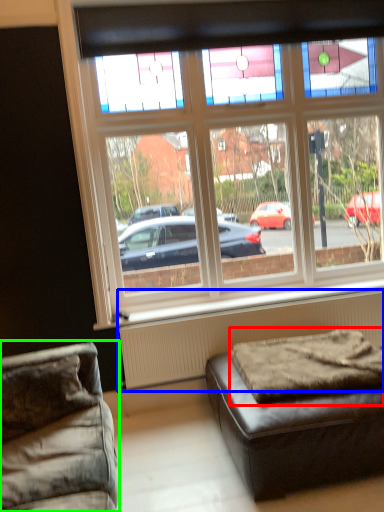
Question: Considering the real-world distances, which object is farthest from mattress (highlighted by a red box)? radiator (highlighted by a blue box) or studio couch (highlighted by a green box)?

Choices:
 (A) radiator
 (B) studio couch

Answer: (B)